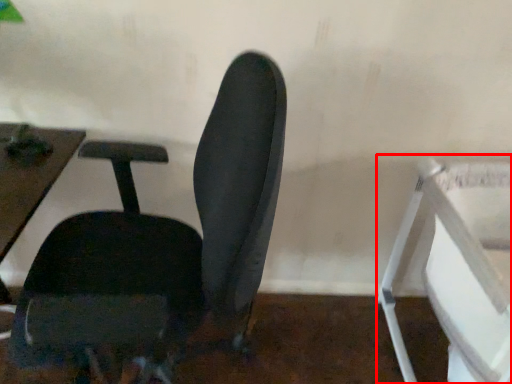
Question: Considering the relative positions of feeding chair (annotated by the red box) and chair in the image provided, where is feeding chair (annotated by the red box) located with respect to the staircase?

Choices:
 (A) left
 (B) right

Answer: (B)